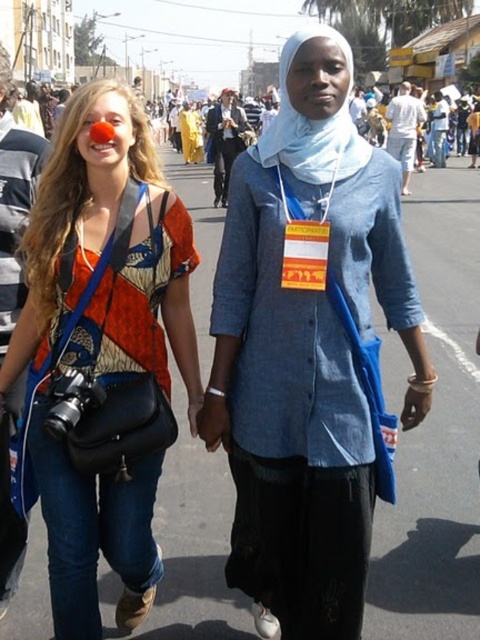
Describe the element at coordinates (100, 355) in the screenshot. The image size is (480, 640). I see `matte black camera at center` at that location.

Is point (71, 99) farther from viewer compared to point (367, 154)?

No, (71, 99) is closer to viewer.

I want to click on matte black camera at center, so click(100, 355).

Consider the image. Can you confirm if blue denim shirt at center is thinner than matte black camera at center?

In fact, blue denim shirt at center might be wider than matte black camera at center.

Between point (277, 525) and point (73, 330), which one is positioned in front?

Positioned in front is point (73, 330).

Between point (352, 317) and point (79, 637), which one is positioned in front?

Positioned in front is point (79, 637).

You are a GUI agent. You are given a task and a screenshot of the screen. Output one action in this format:
    pyautogui.click(x=<x>, y=<y>)
    Task: Click on the blue denim shirt at center
    This screenshot has width=480, height=640.
    Given the screenshot: What is the action you would take?
    pyautogui.click(x=310, y=348)

The image size is (480, 640). Describe the element at coordinates (310, 348) in the screenshot. I see `blue denim shirt at center` at that location.

Is blue denim shirt at center taller than white fabric scarf at center?

In fact, blue denim shirt at center may be shorter than white fabric scarf at center.

Describe the element at coordinates (310, 348) in the screenshot. I see `blue denim shirt at center` at that location.

The width and height of the screenshot is (480, 640). In order to click on blue denim shirt at center in this screenshot , I will do `click(310, 348)`.